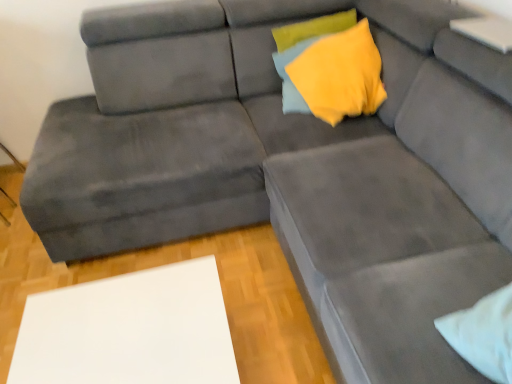
Question: Is yellow fabric pillow at upper center outside white matte table at lower left?

Choices:
 (A) no
 (B) yes

Answer: (B)

Question: From a real-world perspective, is yellow fabric pillow at upper center under white matte table at lower left?

Choices:
 (A) yes
 (B) no

Answer: (B)

Question: Are yellow fabric pillow at upper center and white matte table at lower left making contact?

Choices:
 (A) no
 (B) yes

Answer: (A)

Question: From the image's perspective, would you say yellow fabric pillow at upper center is positioned over white matte table at lower left?

Choices:
 (A) yes
 (B) no

Answer: (A)

Question: Can you confirm if yellow fabric pillow at upper center is positioned to the left of white matte table at lower left?

Choices:
 (A) no
 (B) yes

Answer: (A)

Question: From a real-world perspective, does yellow fabric pillow at upper center stand above white matte table at lower left?

Choices:
 (A) yes
 (B) no

Answer: (A)

Question: Could you tell me if white matte table at lower left is facing yellow fabric pillow at upper center?

Choices:
 (A) yes
 (B) no

Answer: (B)

Question: Does white matte table at lower left contain yellow fabric pillow at upper center?

Choices:
 (A) no
 (B) yes

Answer: (A)

Question: From the image's perspective, is white matte table at lower left located beneath yellow fabric pillow at upper center?

Choices:
 (A) no
 (B) yes

Answer: (B)

Question: Is white matte table at lower left taller than yellow fabric pillow at upper center?

Choices:
 (A) yes
 (B) no

Answer: (A)

Question: From the image's perspective, is white matte table at lower left above yellow fabric pillow at upper center?

Choices:
 (A) yes
 (B) no

Answer: (B)

Question: Considering the relative sizes of white matte table at lower left and yellow fabric pillow at upper center in the image provided, is white matte table at lower left bigger than yellow fabric pillow at upper center?

Choices:
 (A) yes
 (B) no

Answer: (A)

Question: From the image's perspective, is yellow fabric pillow at upper center positioned above or below white matte table at lower left?

Choices:
 (A) above
 (B) below

Answer: (A)